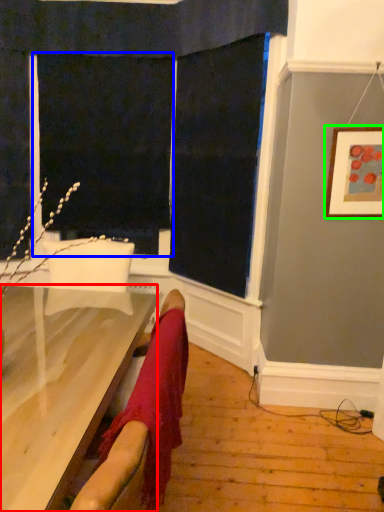
Question: Which object is the farthest from furniture (highlighted by a red box)? Choose among these: screen door (highlighted by a blue box) or picture frame (highlighted by a green box).

Choices:
 (A) screen door
 (B) picture frame

Answer: (A)